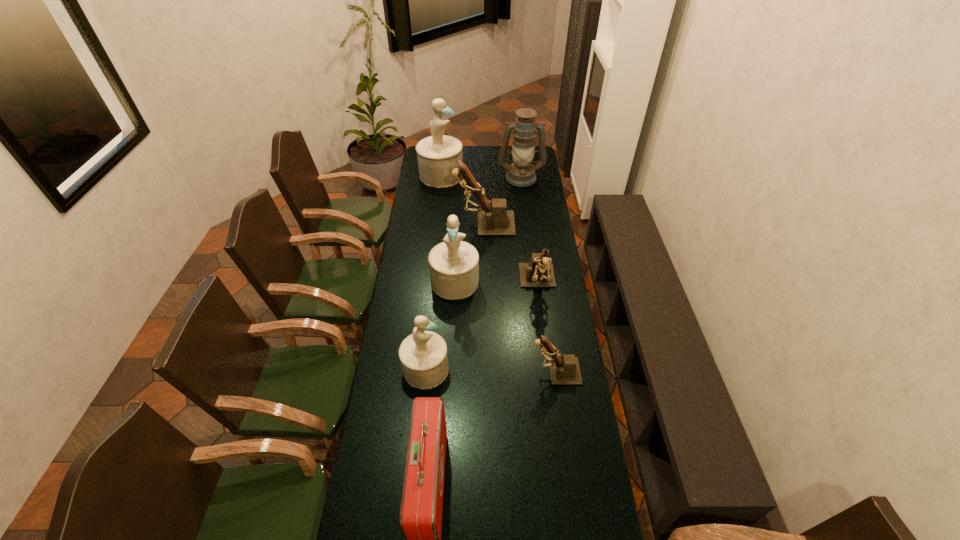
The width and height of the screenshot is (960, 540). I want to click on free space between the second biggest white figurine and the second smallest brown figurine, so click(496, 282).

Identify which object is the fifth closest to the biggest brown figurine. Please provide its 2D coordinates. Your answer should be formatted as a tuple, i.e. [(x, y)], where the tuple contains the x and y coordinates of a point satisfying the conditions above.

[(423, 354)]

Locate an element on the screen. This screenshot has height=540, width=960. the second closest object to the nearest white figurine is located at coordinates (454, 264).

Identify which figurine is the second closest to the second farthest figurine. Please provide its 2D coordinates. Your answer should be formatted as a tuple, i.e. [(x, y)], where the tuple contains the x and y coordinates of a point satisfying the conditions above.

[(454, 264)]

Identify the location of figurine that stands as the fourth closest to the oil lamp. (454, 264).

Identify which white figurine is the closest to the oil lamp. Please provide its 2D coordinates. Your answer should be formatted as a tuple, i.e. [(x, y)], where the tuple contains the x and y coordinates of a point satisfying the conditions above.

[(438, 155)]

Locate an element on the screen. The height and width of the screenshot is (540, 960). the closest white figurine to the nearest white figurine is located at coordinates (454, 264).

You are a GUI agent. You are given a task and a screenshot of the screen. Output one action in this format:
    pyautogui.click(x=<x>, y=<y>)
    Task: Click on the brown figurine that stands as the second closest to the farthest white figurine
    The height and width of the screenshot is (540, 960).
    Given the screenshot: What is the action you would take?
    pyautogui.click(x=538, y=273)

I want to click on the closest brown figurine relative to the smallest brown figurine, so click(538, 273).

I want to click on vacant space that satisfies the following two spatial constraints: 1. on the back side of the oil lamp; 2. at the beak of the tallest figurine, so click(x=520, y=175).